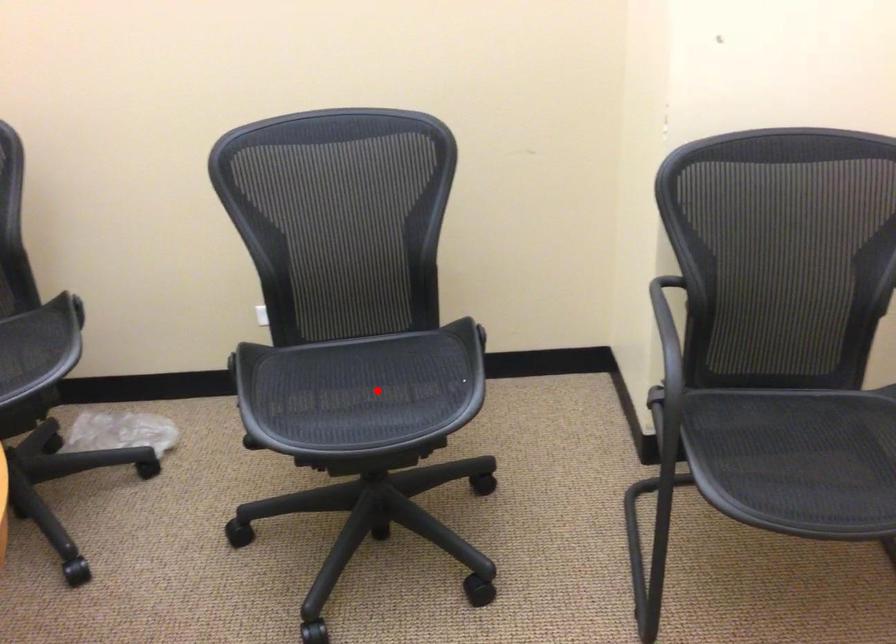
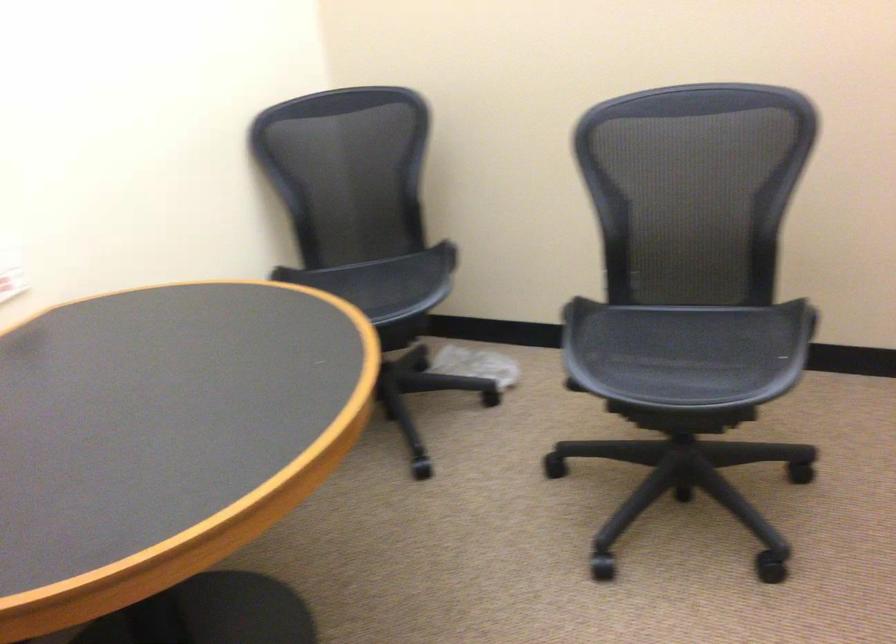
Question: I am providing you with two images of the same scene from different viewpoints. A red point is marked on the first image. Can you still see the location of the red point in image 2?

Choices:
 (A) Yes
 (B) No

Answer: (A)